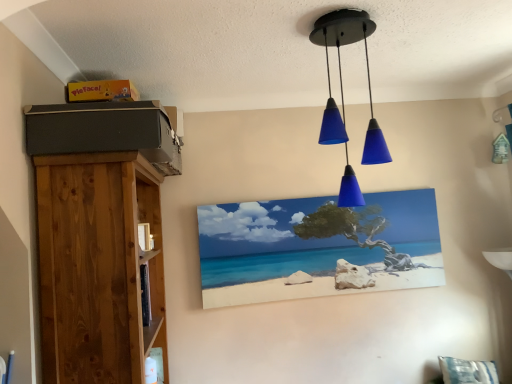
Question: Can you confirm if blue glass pendant lights at upper center is thinner than natural wood bookshelf at left?

Choices:
 (A) yes
 (B) no

Answer: (A)

Question: Is blue glass pendant lights at upper center at the left side of natural wood bookshelf at left?

Choices:
 (A) no
 (B) yes

Answer: (A)

Question: Is blue glass pendant lights at upper center bigger than natural wood bookshelf at left?

Choices:
 (A) no
 (B) yes

Answer: (A)

Question: From a real-world perspective, is blue glass pendant lights at upper center physically above natural wood bookshelf at left?

Choices:
 (A) yes
 (B) no

Answer: (A)

Question: Is blue glass pendant lights at upper center not close to natural wood bookshelf at left?

Choices:
 (A) no
 (B) yes

Answer: (A)

Question: Is natural wood bookshelf at left situated inside blue glass pendant lights at upper center or outside?

Choices:
 (A) outside
 (B) inside

Answer: (A)

Question: In terms of height, does natural wood bookshelf at left look taller or shorter compared to blue glass pendant lights at upper center?

Choices:
 (A) short
 (B) tall

Answer: (B)

Question: From the image's perspective, is natural wood bookshelf at left above or below blue glass pendant lights at upper center?

Choices:
 (A) below
 (B) above

Answer: (A)

Question: In the image, is natural wood bookshelf at left positioned in front of or behind blue glass pendant lights at upper center?

Choices:
 (A) front
 (B) behind

Answer: (A)

Question: From the image's perspective, is blue glass pendant lights at upper center positioned above or below matte canvas painting at center?

Choices:
 (A) below
 (B) above

Answer: (B)

Question: From their relative heights in the image, would you say blue glass pendant lights at upper center is taller or shorter than matte canvas painting at center?

Choices:
 (A) tall
 (B) short

Answer: (A)

Question: Is point (365, 46) positioned closer to the camera than point (439, 276)?

Choices:
 (A) closer
 (B) farther

Answer: (A)

Question: Choose the correct answer: Is blue glass pendant lights at upper center inside matte canvas painting at center or outside it?

Choices:
 (A) inside
 (B) outside

Answer: (B)

Question: Considering the positions of blue glass pendant lights at upper center and natural wood bookshelf at left in the image, is blue glass pendant lights at upper center taller or shorter than natural wood bookshelf at left?

Choices:
 (A) tall
 (B) short

Answer: (B)

Question: Considering the positions of blue glass pendant lights at upper center and natural wood bookshelf at left in the image, is blue glass pendant lights at upper center bigger or smaller than natural wood bookshelf at left?

Choices:
 (A) small
 (B) big

Answer: (A)